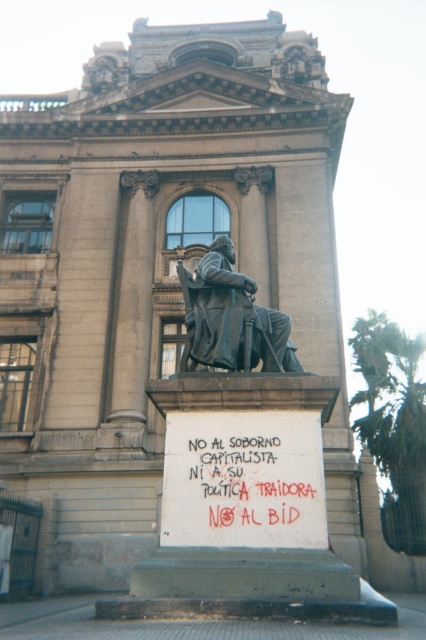
Question: Is red graffiti at center closer to the viewer compared to bronze statue at center?

Choices:
 (A) no
 (B) yes

Answer: (B)

Question: Which point is closer to the camera taking this photo?

Choices:
 (A) (386, 372)
 (B) (250, 298)

Answer: (B)

Question: Which point is closer to the camera?

Choices:
 (A) red graffiti at center
 (B) bronze statue at center

Answer: (A)

Question: Which of the following is the farthest from the observer?

Choices:
 (A) (293, 364)
 (B) (377, 465)

Answer: (B)

Question: Is red graffiti at center smaller than green leafy palm tree at right?

Choices:
 (A) yes
 (B) no

Answer: (A)

Question: Does red graffiti at center have a greater width compared to green leafy palm tree at right?

Choices:
 (A) yes
 (B) no

Answer: (B)